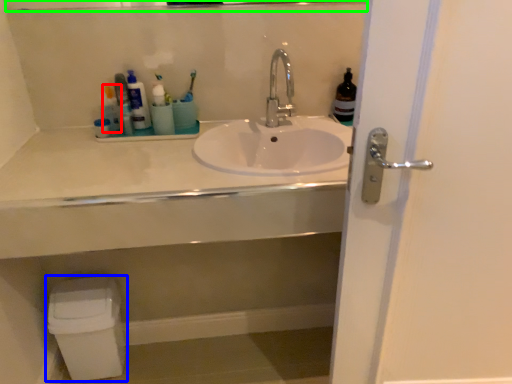
Question: Estimate the real-world distances between objects in this image. Which object is closer to toiletry (highlighted by a red box), toilet bowl (highlighted by a blue box) or mirror (highlighted by a green box)?

Choices:
 (A) toilet bowl
 (B) mirror

Answer: (B)